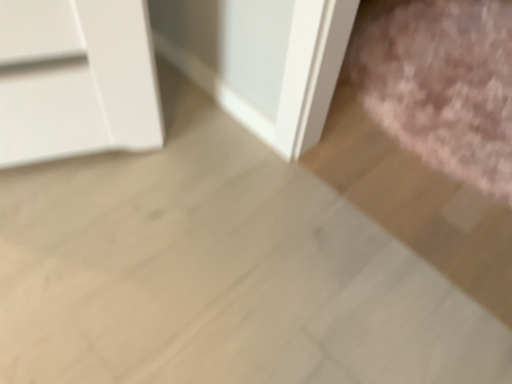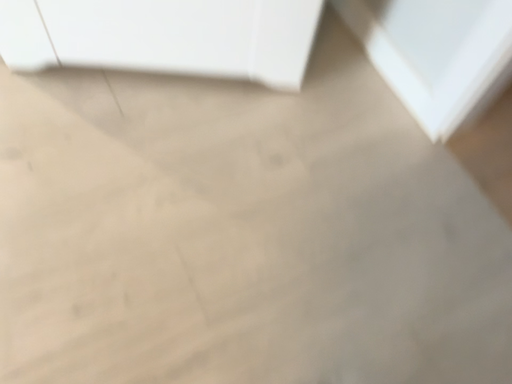
Question: How did the camera likely rotate when shooting the video?

Choices:
 (A) rotated right
 (B) rotated left

Answer: (B)